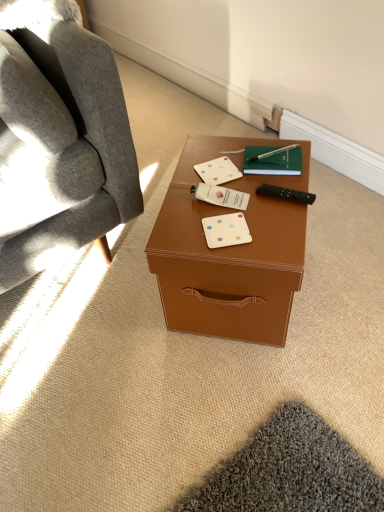
This screenshot has width=384, height=512. I want to click on empty space that is in between green matte notebook at center and white matte business card at center, which is counted as the first business card, starting from the bottom, so click(x=256, y=199).